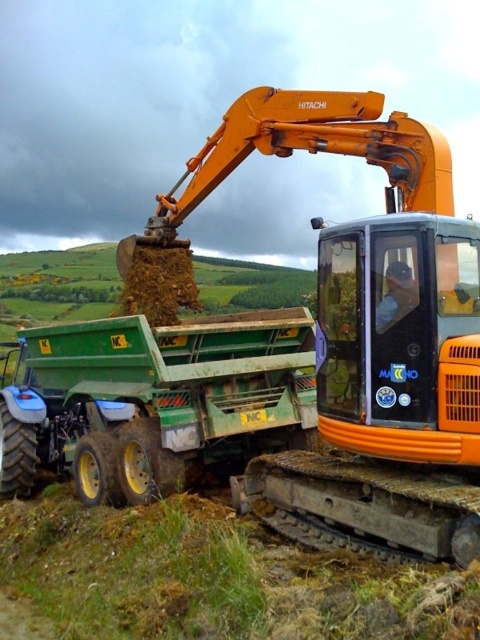
Question: Which object is farther from the camera taking this photo?

Choices:
 (A) orange metallic excavator at center
 (B) green matte trailer truck at center

Answer: (B)

Question: Can you confirm if orange metallic excavator at center is smaller than green matte trailer truck at center?

Choices:
 (A) no
 (B) yes

Answer: (A)

Question: In this image, where is orange metallic excavator at center located relative to green matte trailer truck at center?

Choices:
 (A) above
 (B) below

Answer: (A)

Question: Among these points, which one is farthest from the camera?

Choices:
 (A) (181, 358)
 (B) (180, 202)

Answer: (B)

Question: Is orange metallic excavator at center further to the viewer compared to green matte trailer truck at center?

Choices:
 (A) no
 (B) yes

Answer: (A)